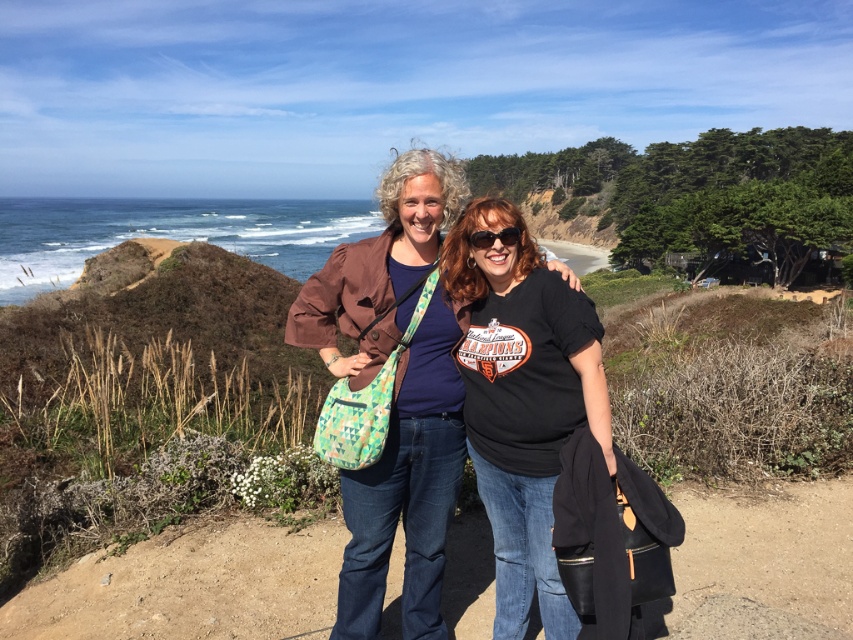
Question: Is matte brown jacket at center to the right of black plastic sunglasses at center from the viewer's perspective?

Choices:
 (A) yes
 (B) no

Answer: (B)

Question: From the image, what is the correct spatial relationship of matte brown jacket at center in relation to black plastic sunglasses at center?

Choices:
 (A) below
 (B) above

Answer: (A)

Question: Which object appears farthest from the camera in this image?

Choices:
 (A) black plastic sunglasses at center
 (B) matte brown jacket at center

Answer: (B)

Question: Which object is farther from the camera taking this photo?

Choices:
 (A) black plastic sunglasses at center
 (B) matte brown jacket at center

Answer: (B)

Question: Does matte brown jacket at center have a lesser width compared to black plastic sunglasses at center?

Choices:
 (A) no
 (B) yes

Answer: (A)

Question: Which object is closer to the camera taking this photo?

Choices:
 (A) black plastic sunglasses at center
 (B) matte brown jacket at center

Answer: (A)